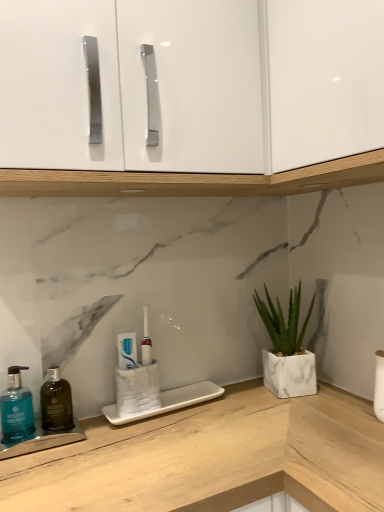
Describe the element at coordinates (56, 402) in the screenshot. The height and width of the screenshot is (512, 384). I see `dark green glass mouthwash at left` at that location.

This screenshot has height=512, width=384. I want to click on dark green glass mouthwash at left, so click(x=56, y=402).

Which of these two, white glossy toothpaste at center or white marble planter at right, is bigger?

With larger size is white marble planter at right.

Which object is wider, white glossy toothpaste at center or white marble planter at right?

white marble planter at right is wider.

Visually, is white glossy toothpaste at center positioned to the left or to the right of white marble planter at right?

In the image, white glossy toothpaste at center appears on the left side of white marble planter at right.

From the picture: How many degrees apart are the facing directions of white glossy toothpaste at center and white marble planter at right?

The facing directions of white glossy toothpaste at center and white marble planter at right are 15.2 degrees apart.

Is dark green glass mouthwash at left at the right side of white marble planter at right?

Incorrect, dark green glass mouthwash at left is not on the right side of white marble planter at right.

Is dark green glass mouthwash at left next to white marble planter at right?

No, dark green glass mouthwash at left is not with white marble planter at right.

From the image's perspective, who appears lower, dark green glass mouthwash at left or white marble planter at right?

From the image's view, dark green glass mouthwash at left is below.

Between dark green glass mouthwash at left and white marble planter at right, which one has smaller width?

dark green glass mouthwash at left.

Can you see dark green glass mouthwash at left touching white glossy toothpaste at center?

No, dark green glass mouthwash at left is not touching white glossy toothpaste at center.

Which object is positioned more to the left, dark green glass mouthwash at left or white glossy toothpaste at center?

Positioned to the left is dark green glass mouthwash at left.

Is point (50, 412) farther from viewer compared to point (130, 367)?

No.

Considering their positions, is white glossy cabinet doors at upper center located in front of or behind white glossy toothpaste at center?

In the image, white glossy cabinet doors at upper center appears in front of white glossy toothpaste at center.

Find the location of a particular element. The height and width of the screenshot is (512, 384). toothpaste lying behind the white glossy cabinet doors at upper center is located at coordinates (127, 350).

Considering the sizes of objects white glossy cabinet doors at upper center and white glossy toothpaste at center in the image provided, who is thinner, white glossy cabinet doors at upper center or white glossy toothpaste at center?

white glossy toothpaste at center is thinner.

From the image's perspective, between white glossy cabinet doors at upper center and white glossy toothpaste at center, which one is located above?

From the image's view, white glossy cabinet doors at upper center is above.

Which of these two, white marble planter at right or dark green glass mouthwash at left, stands shorter?

dark green glass mouthwash at left.

Can you confirm if white marble planter at right is smaller than dark green glass mouthwash at left?

Actually, white marble planter at right might be larger than dark green glass mouthwash at left.

Does white marble planter at right turn towards dark green glass mouthwash at left?

No, white marble planter at right is not facing towards dark green glass mouthwash at left.

Is white marble planter at right far from dark green glass mouthwash at left?

white marble planter at right is actually quite close to dark green glass mouthwash at left.

Considering the sizes of white glossy cabinet doors at upper center and white marble planter at right in the image, is white glossy cabinet doors at upper center bigger or smaller than white marble planter at right?

Considering their sizes, white glossy cabinet doors at upper center takes up more space than white marble planter at right.

Does white glossy cabinet doors at upper center lie in front of white marble planter at right?

Yes, white glossy cabinet doors at upper center is closer to the viewer.

From a real-world perspective, is white glossy cabinet doors at upper center physically located above or below white marble planter at right?

Clearly, from a real-world perspective, white glossy cabinet doors at upper center is above white marble planter at right.

What's the angular difference between white glossy cabinet doors at upper center and white marble planter at right's facing directions?

15.2 degrees separate the facing orientations of white glossy cabinet doors at upper center and white marble planter at right.

Consider the image. From the image's perspective, who appears lower, teal matte soap dispenser at lower left or dark green glass mouthwash at left?

dark green glass mouthwash at left.

Does teal matte soap dispenser at lower left turn towards dark green glass mouthwash at left?

No, teal matte soap dispenser at lower left is not turned towards dark green glass mouthwash at left.

Is teal matte soap dispenser at lower left spatially inside dark green glass mouthwash at left, or outside of it?

teal matte soap dispenser at lower left lies outside dark green glass mouthwash at left.

Who is taller, teal matte soap dispenser at lower left or dark green glass mouthwash at left?

dark green glass mouthwash at left.

The width and height of the screenshot is (384, 512). In order to click on houseplant that appears on the right of white glossy toothpaste at center in this screenshot , I will do `click(287, 348)`.

You are a GUI agent. You are given a task and a screenshot of the screen. Output one action in this format:
    pyautogui.click(x=<x>, y=<y>)
    Task: Click on the houseplant above the dark green glass mouthwash at left (from the image's perspective)
    Image resolution: width=384 pixels, height=512 pixels.
    Given the screenshot: What is the action you would take?
    pyautogui.click(x=287, y=348)

When comparing their distances from white glossy cabinet doors at upper center, does dark green glass mouthwash at left or white glossy toothpaste at center seem further?

dark green glass mouthwash at left lies further to white glossy cabinet doors at upper center than the other object.

Based on their spatial positions, is dark green glass mouthwash at left or white marble planter at right further from white glossy toothpaste at center?

white marble planter at right is positioned further to the anchor white glossy toothpaste at center.

Looking at the image, which one is located further to white glossy cabinet doors at upper center, teal matte soap dispenser at lower left or white marble planter at right?

teal matte soap dispenser at lower left lies further to white glossy cabinet doors at upper center than the other object.

When comparing their distances from white glossy toothpaste at center, does dark green glass mouthwash at left or white glossy cabinet doors at upper center seem closer?

dark green glass mouthwash at left is closer to white glossy toothpaste at center.

From the image, which object appears to be farther from dark green glass mouthwash at left, teal matte soap dispenser at lower left or white glossy cabinet doors at upper center?

white glossy cabinet doors at upper center lies further to dark green glass mouthwash at left than the other object.

Estimate the real-world distances between objects in this image. Which object is further from white marble planter at right, teal matte soap dispenser at lower left or white glossy toothpaste at center?

The object further to white marble planter at right is teal matte soap dispenser at lower left.

Based on the photo, when comparing their distances from white marble planter at right, does white glossy cabinet doors at upper center or teal matte soap dispenser at lower left seem closer?

white glossy cabinet doors at upper center lies closer to white marble planter at right than the other object.

Which object lies nearer to the anchor point dark green glass mouthwash at left, white glossy toothpaste at center or white glossy cabinet doors at upper center?

The object closer to dark green glass mouthwash at left is white glossy toothpaste at center.

You are a GUI agent. You are given a task and a screenshot of the screen. Output one action in this format:
    pyautogui.click(x=<x>, y=<y>)
    Task: Click on the toothpaste situated between teal matte soap dispenser at lower left and white marble planter at right from left to right
    The image size is (384, 512).
    Given the screenshot: What is the action you would take?
    pyautogui.click(x=127, y=350)

Locate an element on the screen. The width and height of the screenshot is (384, 512). toothpaste between dark green glass mouthwash at left and white marble planter at right in the horizontal direction is located at coordinates point(127,350).

Where is `houseplant between white glossy cabinet doors at upper center and white glossy toothpaste at center from top to bottom`? The image size is (384, 512). houseplant between white glossy cabinet doors at upper center and white glossy toothpaste at center from top to bottom is located at coordinates 287,348.

This screenshot has width=384, height=512. Find the location of `mouthwash between teal matte soap dispenser at lower left and white marble planter at right`. mouthwash between teal matte soap dispenser at lower left and white marble planter at right is located at coordinates (56, 402).